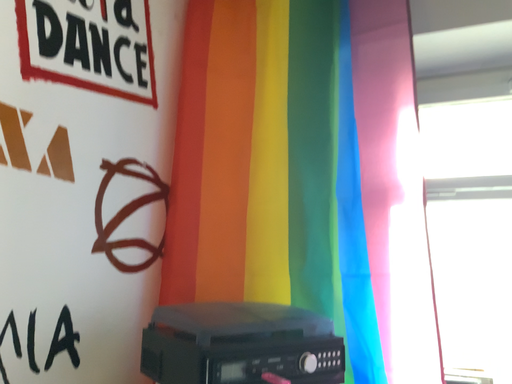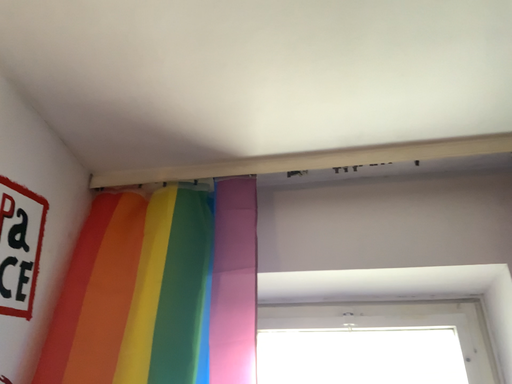
Question: How did the camera likely rotate when shooting the video?

Choices:
 (A) rotated left
 (B) rotated right

Answer: (B)